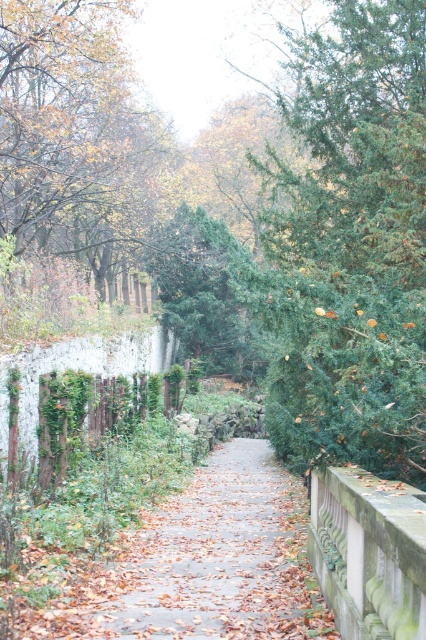
In the scene shown: Can you confirm if brown leafy path at center is thinner than stone balustrade at right?

Incorrect, brown leafy path at center's width is not less than stone balustrade at right's.

Does point (317, 600) come closer to viewer compared to point (371, 497)?

No, (317, 600) is further to viewer.

This screenshot has width=426, height=640. In order to click on brown leafy path at center in this screenshot , I will do `click(216, 561)`.

Can you confirm if brown leafy tree at upper left is taller than brown leafy path at center?

Correct, brown leafy tree at upper left is much taller as brown leafy path at center.

Consider the image. Is brown leafy tree at upper left behind brown leafy path at center?

Yes, brown leafy tree at upper left is further from the viewer.

Between point (85, 253) and point (152, 548), which one is positioned behind?

The point (85, 253) is more distant.

What are the coordinates of `brown leafy tree at upper left` in the screenshot? It's located at click(74, 132).

From the picture: Is green textured tree at center to the left of brown leafy tree at upper left from the viewer's perspective?

No, green textured tree at center is not to the left of brown leafy tree at upper left.

Which is above, green textured tree at center or brown leafy tree at upper left?

brown leafy tree at upper left is higher up.

Which is in front, point (397, 188) or point (100, 196)?

Point (397, 188) is more forward.

Locate an element on the screen. The height and width of the screenshot is (640, 426). green textured tree at center is located at coordinates (351, 244).